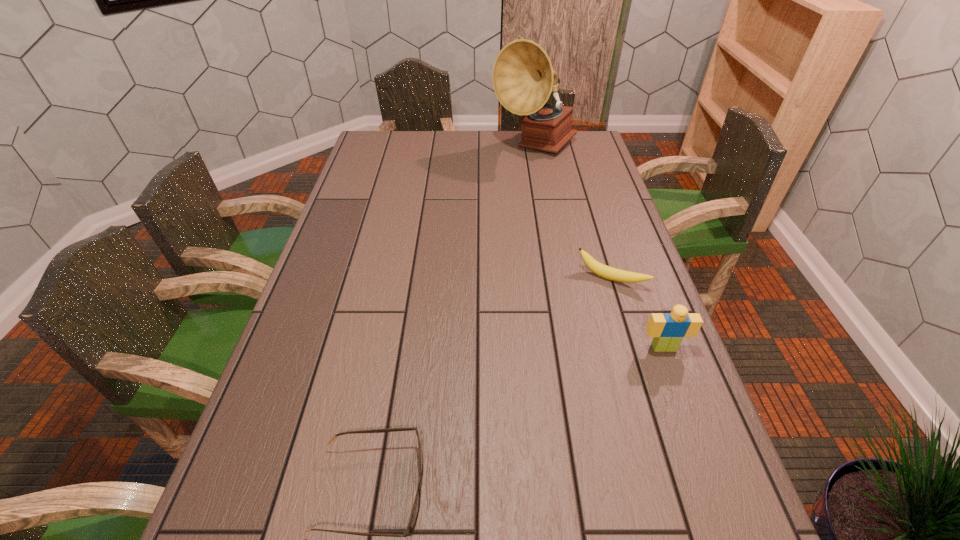
This screenshot has width=960, height=540. Find the location of `Lego`. Lego is located at coordinates tap(668, 330).

The height and width of the screenshot is (540, 960). Identify the location of the third farthest object. (668, 330).

At what (x,y) coordinates should I click in order to perform the action: click on the third nearest object. Please return your answer as a coordinate pair (x, y). This screenshot has height=540, width=960. Looking at the image, I should click on (607, 272).

Where is `banana`? The height and width of the screenshot is (540, 960). banana is located at coordinates (607, 272).

Locate an element on the screen. This screenshot has width=960, height=540. phonograph record is located at coordinates (523, 78).

Image resolution: width=960 pixels, height=540 pixels. I want to click on the tallest object, so click(523, 78).

Where is `vacant region located 0.310m on the face of the third farthest object`? The width and height of the screenshot is (960, 540). vacant region located 0.310m on the face of the third farthest object is located at coordinates (717, 491).

You are a GUI agent. You are given a task and a screenshot of the screen. Output one action in this format:
    pyautogui.click(x=<x>, y=<y>)
    Task: Click on the vacant space located 0.070m on the upward curve of the third nearest object
    The width and height of the screenshot is (960, 540).
    Given the screenshot: What is the action you would take?
    pyautogui.click(x=589, y=307)

At what (x,y) coordinates should I click in order to perform the action: click on free space located on the upward curve of the third nearest object. Please return your answer as a coordinate pair (x, y). This screenshot has width=960, height=540. Looking at the image, I should click on (568, 349).

Where is `vacant space located on the upward curve of the third nearest object`? The height and width of the screenshot is (540, 960). vacant space located on the upward curve of the third nearest object is located at coordinates (590, 305).